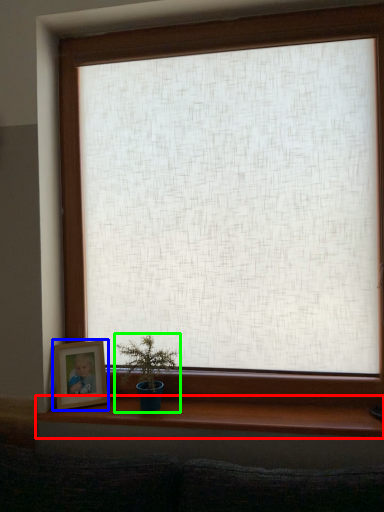
Question: Which object is the closest to the window sill (highlighted by a red box)? Choose among these: picture frame (highlighted by a blue box) or houseplant (highlighted by a green box).

Choices:
 (A) picture frame
 (B) houseplant

Answer: (B)